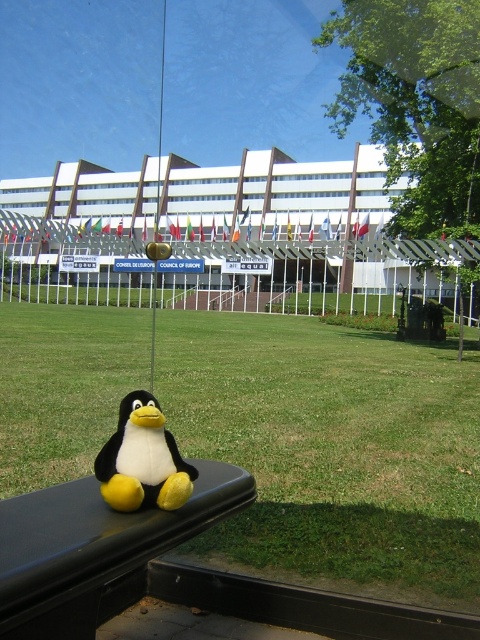
Based on the photo, you are a visitor at this modern building and want to sit down. You see the green grass at lower center and the black plastic bench at lower left. Which one is closer to your right side if you are facing the building?

The green grass at lower center is to the right of the black plastic bench at lower left, so if you are facing the building, the green grass at lower center would be closer to your right side.